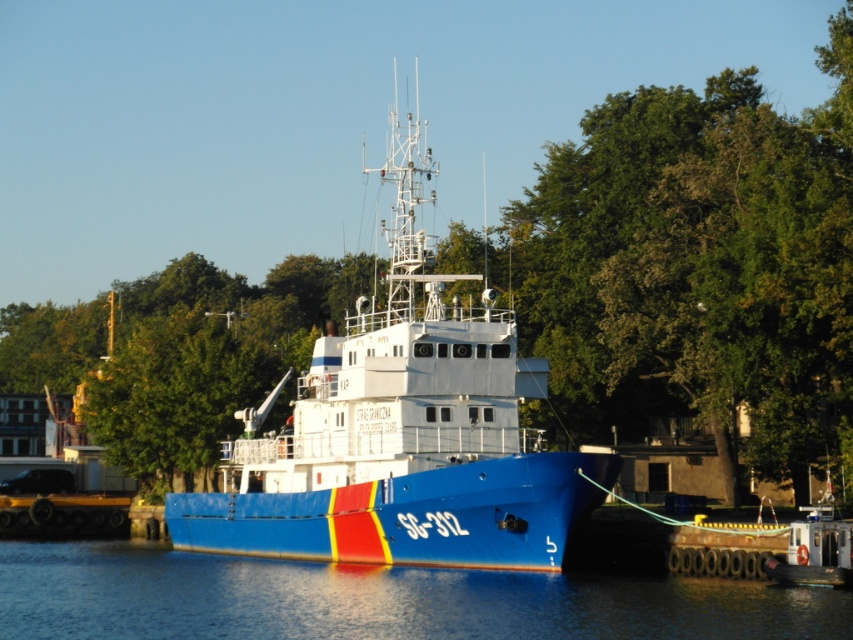
Between blue matte boat at center and blue glossy water at lower center, which one has more height?

blue matte boat at center

Is point (450, 282) positioned behind point (837, 632)?

Yes, it is behind point (837, 632).

This screenshot has width=853, height=640. In order to click on blue matte boat at center in this screenshot , I will do `click(402, 433)`.